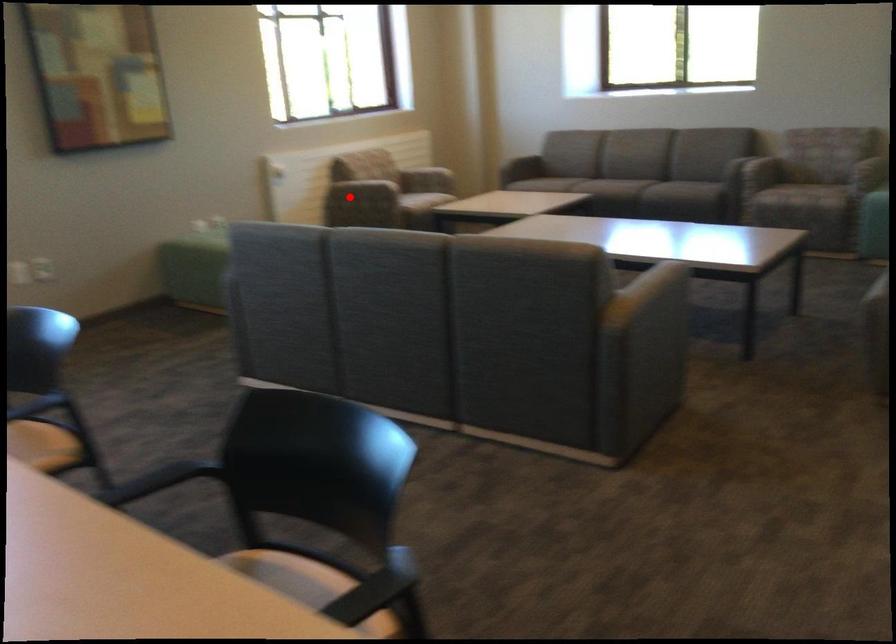
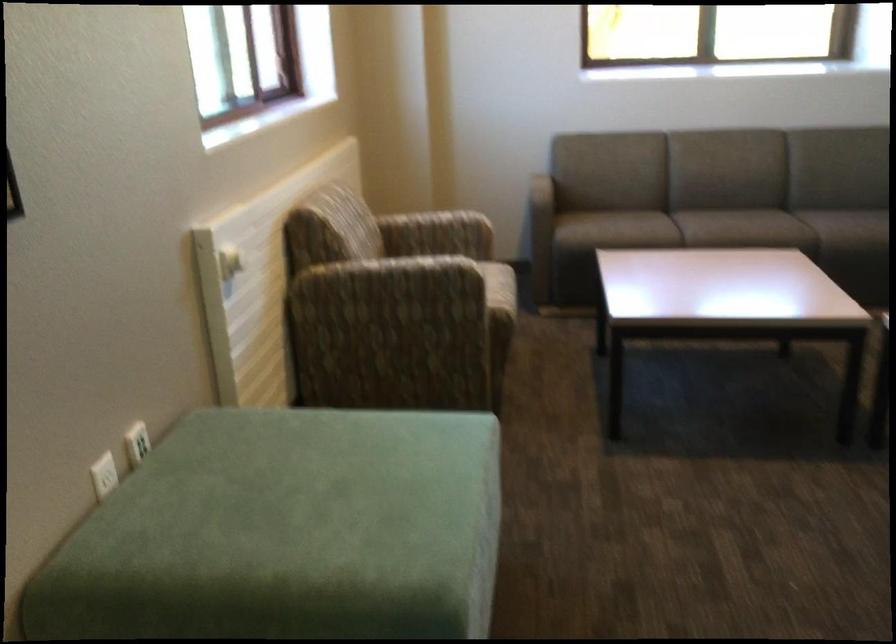
Find the pixel in the second image that matches the highlighted location in the first image.

(386, 312)